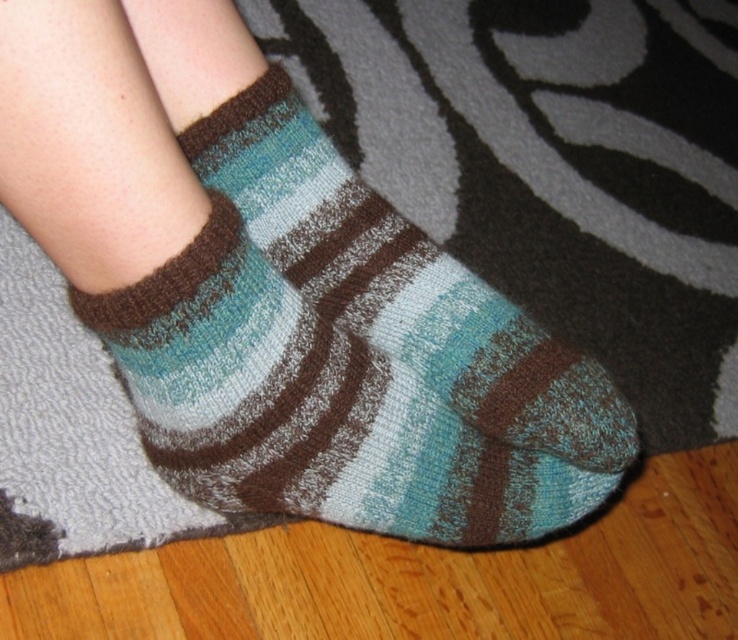
Question: Is teal striped sock at lower center positioned before teal knitted sock at center?

Choices:
 (A) yes
 (B) no

Answer: (A)

Question: Among these objects, which one is farthest from the camera?

Choices:
 (A) teal striped sock at lower center
 (B) teal knitted sock at center

Answer: (B)

Question: Is teal striped sock at lower center below teal knitted sock at center?

Choices:
 (A) no
 (B) yes

Answer: (B)

Question: Is teal striped sock at lower center positioned behind teal knitted sock at center?

Choices:
 (A) no
 (B) yes

Answer: (A)